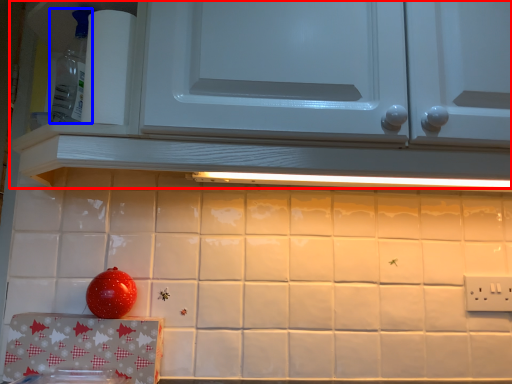
Question: Which of the following is the farthest to the observer, cabinetry (highlighted by a red box) or appliance (highlighted by a blue box)?

Choices:
 (A) cabinetry
 (B) appliance

Answer: (B)